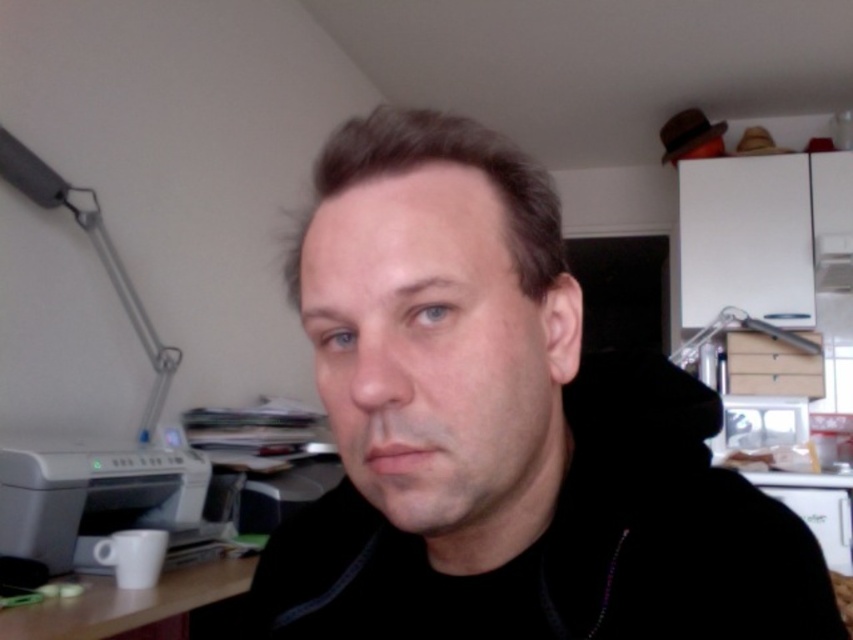
Does white matte table at lower left appear under matte gray lamp at upper left?

Yes, white matte table at lower left is below matte gray lamp at upper left.

Describe the element at coordinates (126, 602) in the screenshot. This screenshot has width=853, height=640. I see `white matte table at lower left` at that location.

The width and height of the screenshot is (853, 640). What are the coordinates of `white matte table at lower left` in the screenshot? It's located at (126, 602).

Between point (376, 534) and point (74, 625), which one is positioned behind?

The point (74, 625) is behind.

Which is more to the left, black matte jacket at center or white matte table at lower left?

From the viewer's perspective, white matte table at lower left appears more on the left side.

Between point (415, 344) and point (224, 570), which one is positioned behind?

Positioned behind is point (224, 570).

This screenshot has height=640, width=853. What are the coordinates of `black matte jacket at center` in the screenshot? It's located at (502, 429).

Which is below, black matte jacket at center or white plastic printer at lower left?

white plastic printer at lower left is lower down.

Is black matte jacket at center wider than white plastic printer at lower left?

Yes, black matte jacket at center is wider than white plastic printer at lower left.

Which is behind, point (496, 216) or point (97, 504)?

The point (97, 504) is behind.

This screenshot has height=640, width=853. Identify the location of black matte jacket at center. (502, 429).